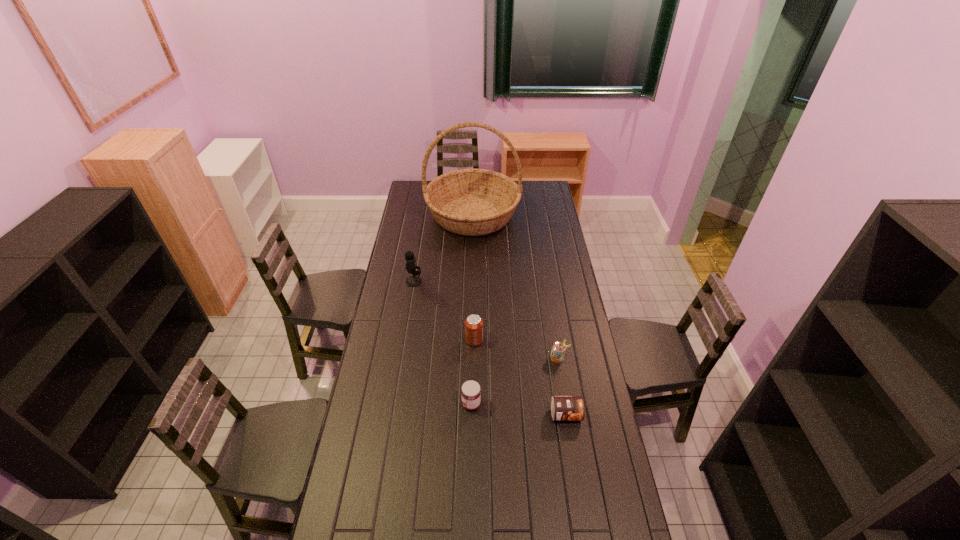
Locate an element on the screen. vacant area between the second farthest object and the fourth nearest object is located at coordinates (444, 310).

I want to click on vacant area that lies between the third nearest object and the second tallest object, so click(486, 319).

Find the location of a particular element. vacant area that lies between the shortest object and the fourth farthest object is located at coordinates (562, 386).

Where is `vacant area that lies between the second tallest can and the nearest can`? vacant area that lies between the second tallest can and the nearest can is located at coordinates (562, 386).

Locate an element on the screen. The image size is (960, 540). object that is the second closest to the jam is located at coordinates (563, 408).

The height and width of the screenshot is (540, 960). What are the coordinates of `object identified as the closest to the jam` in the screenshot? It's located at tap(473, 324).

Identify which can is the third nearest to the farthest object. Please provide its 2D coordinates. Your answer should be formatted as a tuple, i.e. [(x, y)], where the tuple contains the x and y coordinates of a point satisfying the conditions above.

[(563, 408)]

At what (x,y) coordinates should I click in order to perform the action: click on the closest can to the fourth shortest object. Please return your answer as a coordinate pair (x, y). This screenshot has width=960, height=540. Looking at the image, I should click on (558, 348).

Find the location of a particular element. free spot that satisfies the following two spatial constraints: 1. on the front side of the fifth nearest object; 2. on the left side of the second nearest can is located at coordinates 401,357.

This screenshot has width=960, height=540. What are the coordinates of `free space that satisfies the following two spatial constraints: 1. on the back side of the farthest can; 2. on the right side of the jam` in the screenshot? It's located at (472, 340).